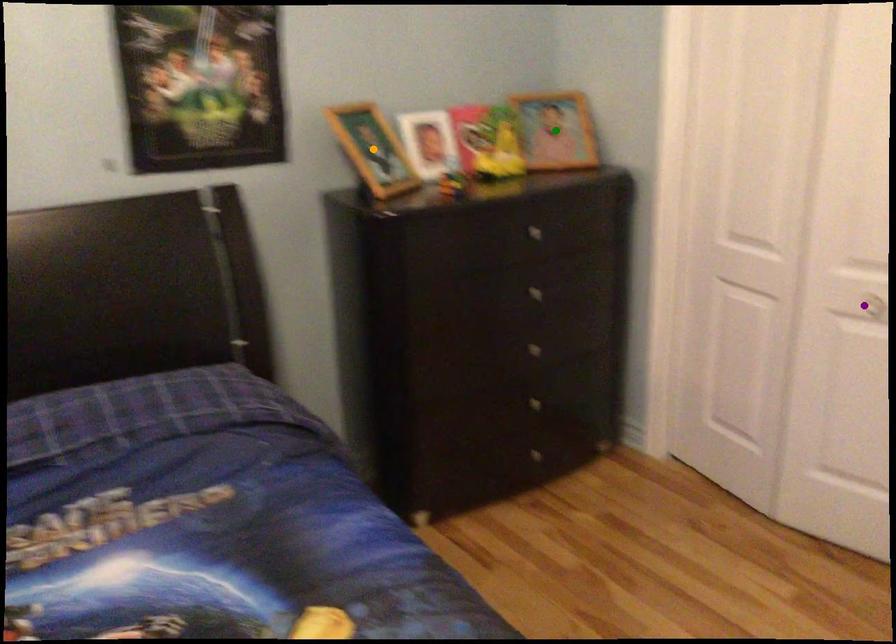
Order these from nearest to farthest:
purple point | orange point | green point

green point
orange point
purple point